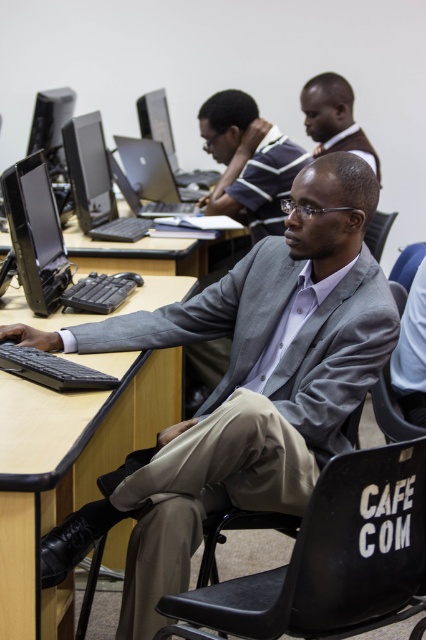
Question: Which of the following is the farthest from the observer?

Choices:
 (A) (305, 129)
 (B) (34, 140)
 (C) (400, 609)

Answer: (B)

Question: Which of the following is the farthest from the observer?

Choices:
 (A) (150, 436)
 (B) (268, 129)

Answer: (B)

Question: Can you confirm if black glossy monitor at left is positioned to the right of black fabric chair at lower right?

Choices:
 (A) no
 (B) yes

Answer: (A)

Question: Is black plastic laptop at center to the right of silver metallic laptop at center from the viewer's perspective?

Choices:
 (A) no
 (B) yes

Answer: (A)

Question: Can you confirm if black leather chair at center is positioned to the right of silver metallic laptop at center?

Choices:
 (A) yes
 (B) no

Answer: (A)

Question: Which point is farther from the camera taking this photo?

Choices:
 (A) (351, 424)
 (B) (146, 314)
 (C) (249, 209)

Answer: (C)